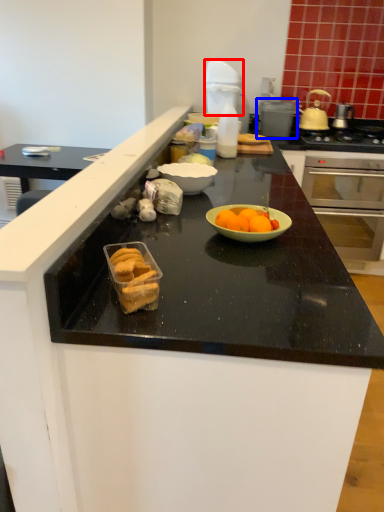
Question: Which of the following is the farthest to the observer, kitchen appliance (highlighted by a red box) or appliance (highlighted by a blue box)?

Choices:
 (A) kitchen appliance
 (B) appliance

Answer: (B)